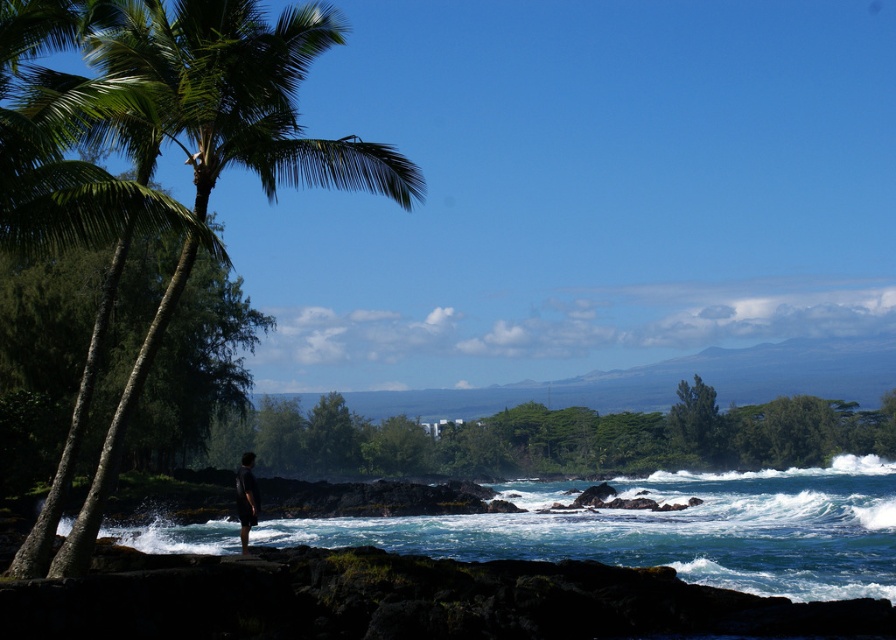
Is blue water at center taller than green leafy palm tree at left?

Indeed, blue water at center has a greater height compared to green leafy palm tree at left.

Can you confirm if blue water at center is thinner than green leafy palm tree at left?

No.

Who is more distant from viewer, [683,492] or [116,412]?

The point [683,492] is more distant.

Image resolution: width=896 pixels, height=640 pixels. I want to click on blue water at center, so click(x=670, y=529).

This screenshot has height=640, width=896. What are the coordinates of `green leafy palm tree at left` in the screenshot? It's located at (244, 96).

Measure the distance from green leafy palm tree at left to dark gray shorts at center.

A distance of 5.50 meters exists between green leafy palm tree at left and dark gray shorts at center.

Identify the location of green leafy palm tree at left. (244, 96).

This screenshot has height=640, width=896. I want to click on green leafy palm tree at left, so (244, 96).

Can you confirm if blue water at center is positioned above dark gray shorts at center?

No.

Is blue water at center positioned before dark gray shorts at center?

No.

Between point (855, 522) and point (248, 506), which one is positioned in front?

Point (248, 506)

Where is `blue water at center`? This screenshot has height=640, width=896. blue water at center is located at coordinates (670, 529).